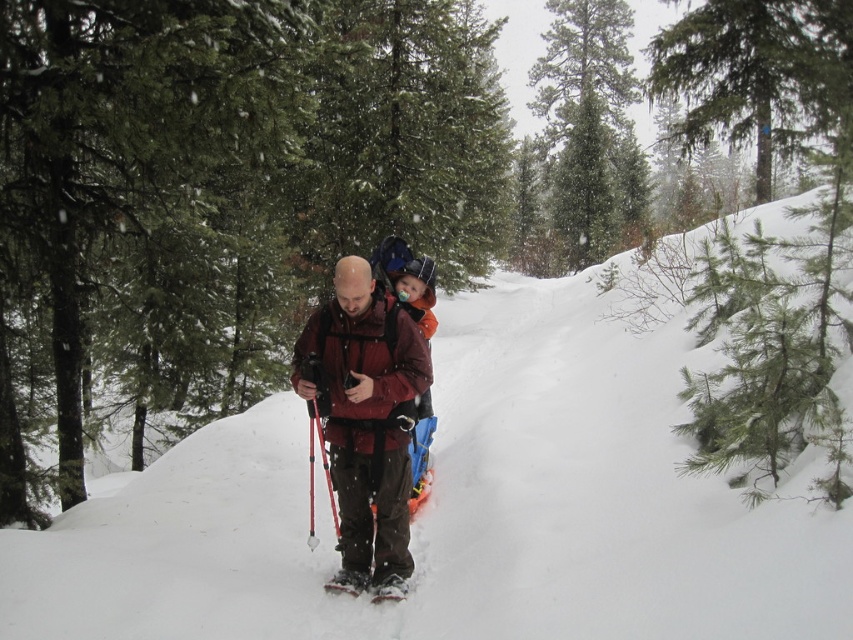
Question: Can you confirm if matte red jacket at center is thinner than black rubber snowshoe at lower center?

Choices:
 (A) yes
 (B) no

Answer: (B)

Question: Does matte red jacket at center have a larger size compared to white rubber snowshoe at lower center?

Choices:
 (A) yes
 (B) no

Answer: (A)

Question: Can you confirm if white fluffy snow at center is thinner than white rubber snowshoe at lower center?

Choices:
 (A) yes
 (B) no

Answer: (B)

Question: Estimate the real-world distances between objects in this image. Which object is closer to the matte red jacket at center?

Choices:
 (A) green textured pine tree at upper center
 (B) white fluffy snow at center

Answer: (B)

Question: Which of the following is the farthest from the observer?

Choices:
 (A) matte red jacket at center
 (B) white fluffy snow at center
 (C) green textured pine tree at upper center

Answer: (C)

Question: Which of these objects is positioned farthest from the white rubber snowshoe at lower center?

Choices:
 (A) reddish-brown fabric snowshoe at center
 (B) orange soft shell jacket at center
 (C) black rubber snowshoe at lower center

Answer: (B)